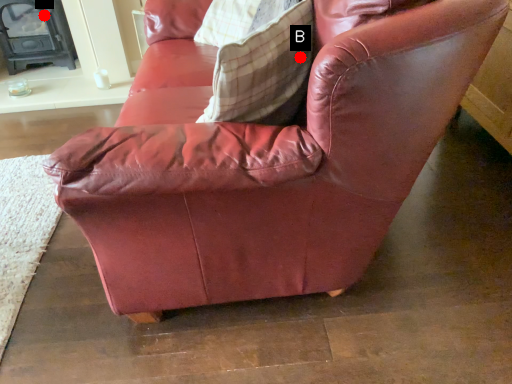
Question: Two points are circled on the image, labeled by A and B beside each circle. Which point is closer to the camera taking this photo?

Choices:
 (A) A is closer
 (B) B is closer

Answer: (B)